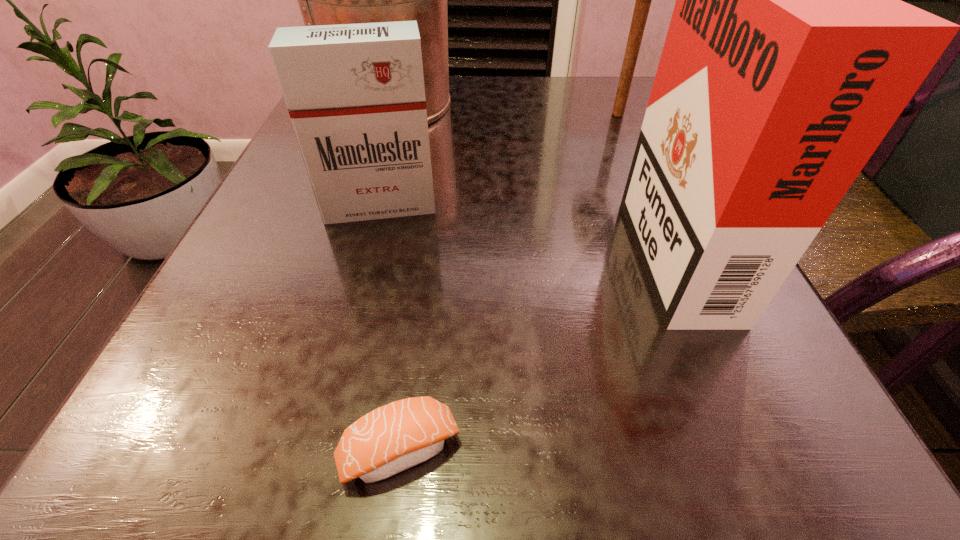
The image size is (960, 540). Find the location of `free region located 0.360m on the front-facing side of the taller cigarette case`. free region located 0.360m on the front-facing side of the taller cigarette case is located at coordinates (383, 243).

This screenshot has height=540, width=960. What are the coordinates of `vacant region located on the front-facing side of the taller cigarette case` in the screenshot? It's located at (376, 243).

Where is `vacant space situated 0.140m on the right of the left cigarette case`? The image size is (960, 540). vacant space situated 0.140m on the right of the left cigarette case is located at coordinates 526,206.

Image resolution: width=960 pixels, height=540 pixels. Identify the location of free region located on the back of the nearest object. (428, 234).

You are a GUI agent. You are given a task and a screenshot of the screen. Output one action in this format:
    pyautogui.click(x=<x>, y=<y>)
    Task: Click on the bucket located at the far edge
    This screenshot has height=540, width=960.
    Given the screenshot: What is the action you would take?
    pyautogui.click(x=323, y=0)

Locate an element on the screen. This screenshot has width=960, height=540. mallet situated at the far edge is located at coordinates (643, 0).

At what (x,y) coordinates should I click in order to perform the action: click on object that is at the near edge. Please return your answer as a coordinate pair (x, y). The width and height of the screenshot is (960, 540). Looking at the image, I should click on (395, 437).

Locate an element on the screen. bucket located in the left edge section of the desktop is located at coordinates (323, 0).

Where is `cigarette case at the left edge`? The height and width of the screenshot is (540, 960). cigarette case at the left edge is located at coordinates (355, 93).

The height and width of the screenshot is (540, 960). I want to click on mallet that is at the right edge, so click(x=643, y=0).